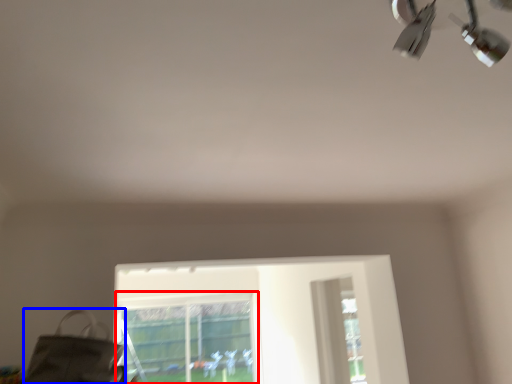
Question: Which object is closer to the camera taking this photo, bay window (highlighted by a red box) or messenger bag (highlighted by a blue box)?

Choices:
 (A) bay window
 (B) messenger bag

Answer: (B)